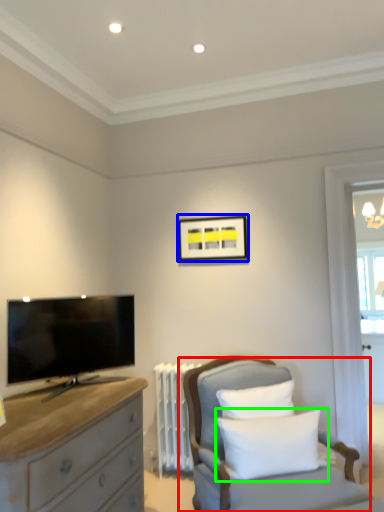
Question: Estimate the real-world distances between objects in this image. Which object is farther from chair (highlighted by a red box), picture frame (highlighted by a blue box) or pillow (highlighted by a green box)?

Choices:
 (A) picture frame
 (B) pillow

Answer: (A)